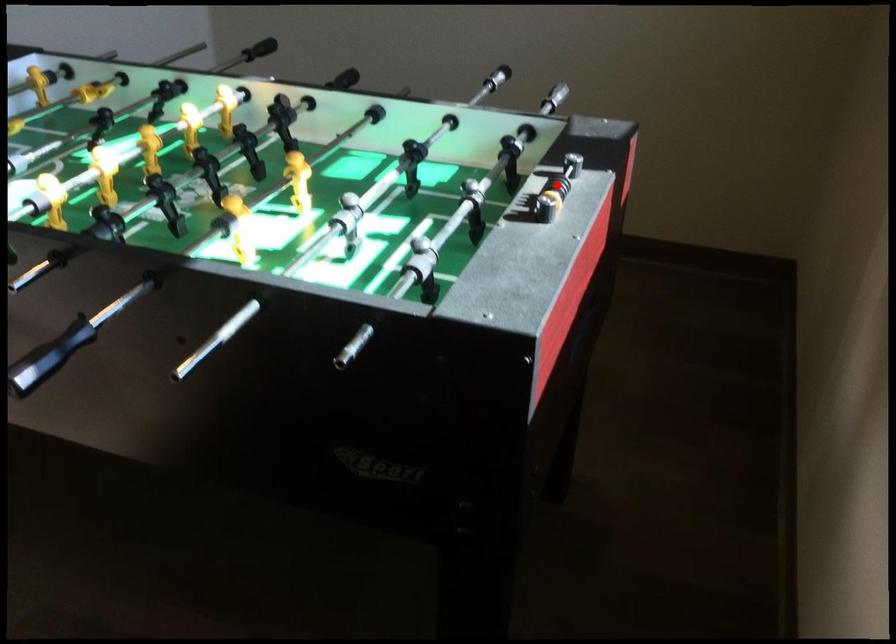
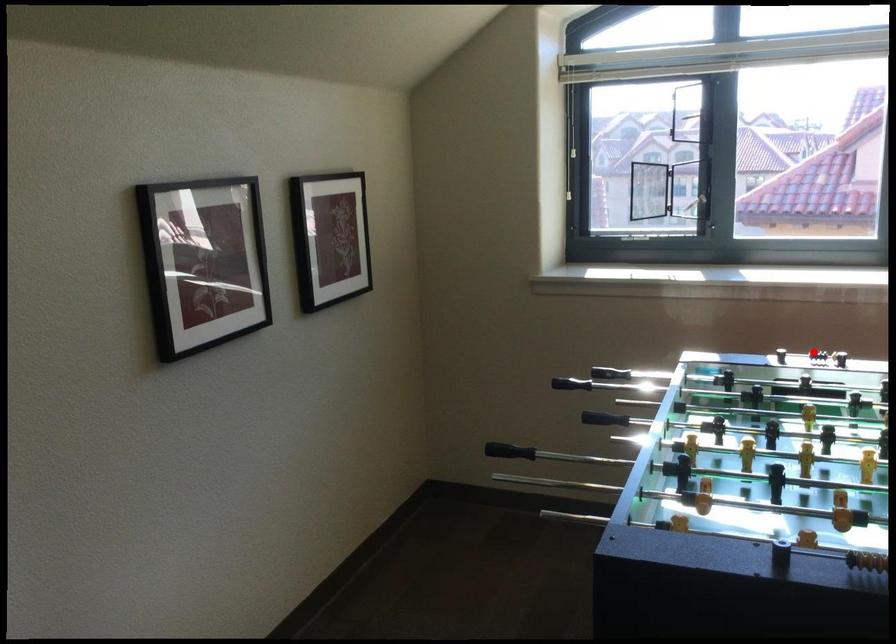
Consider the image. I am providing you with two images of the same scene from different viewpoints. A red point is marked on the first image and another point is marked on the second image. Is the marked point in image1 the same physical position as the marked point in image2?

Yes